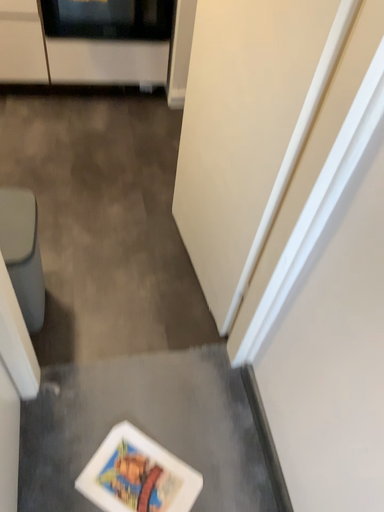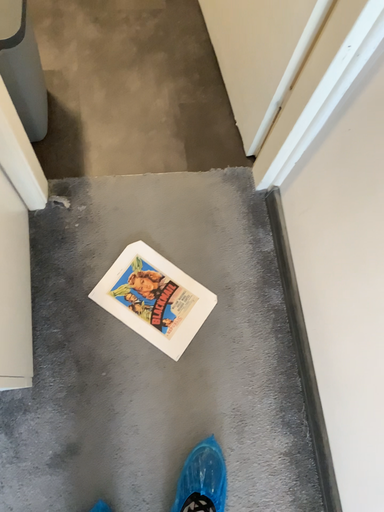
Question: Which way did the camera rotate in the video?

Choices:
 (A) rotated downward
 (B) rotated upward

Answer: (A)